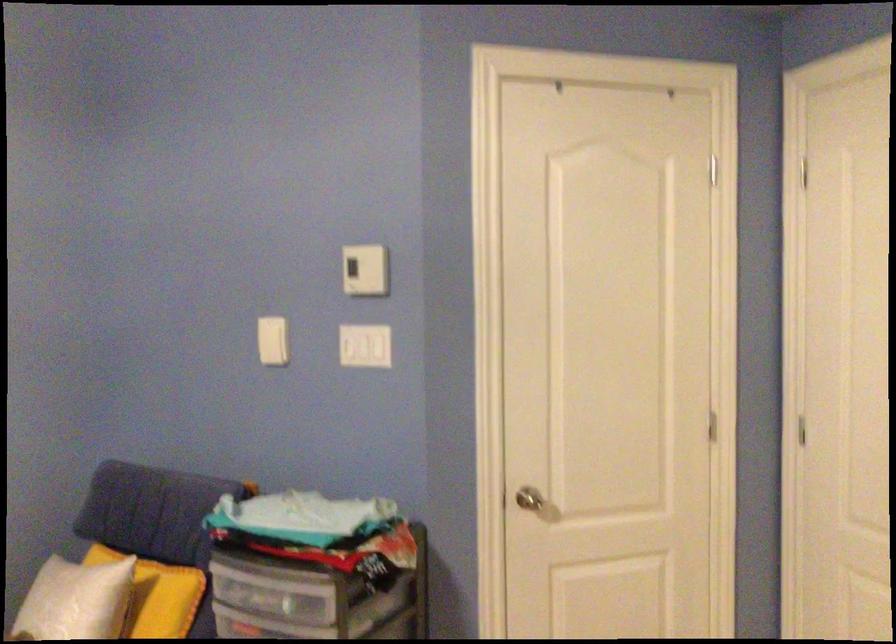
Locate an element on the screen. This screenshot has height=644, width=896. silver door knob is located at coordinates (531, 502).